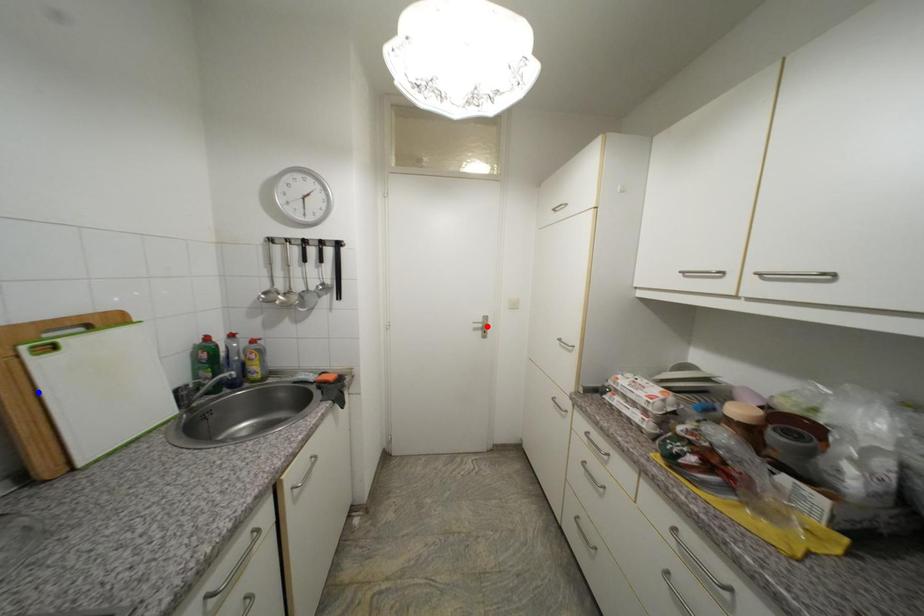
Question: Which of the two points in the image is closer to the camera?

Choices:
 (A) Blue point is closer.
 (B) Red point is closer.

Answer: (A)